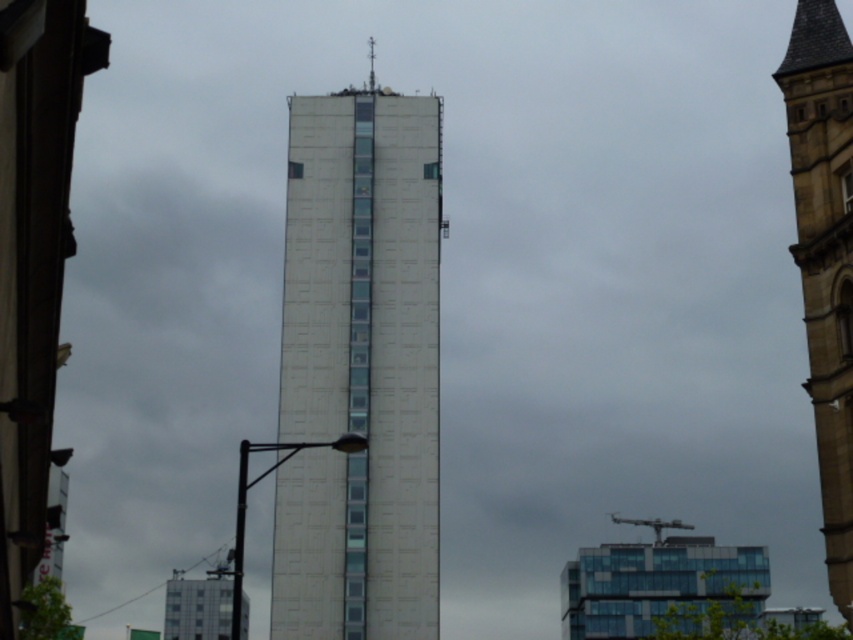
Identify the location of white textured building at center. The image size is (853, 640). (358, 369).

Can you confirm if white textured building at center is smaller than stone tower at center?

Actually, white textured building at center might be larger than stone tower at center.

Locate an element on the screen. white textured building at center is located at coordinates (358, 369).

Which is more to the left, white textured building at center or metallic spire at upper center?

metallic spire at upper center

Who is taller, white textured building at center or metallic spire at upper center?

white textured building at center is taller.

Identify the location of white textured building at center. This screenshot has height=640, width=853. (358, 369).

Identify the location of white textured building at center. (358, 369).

Is point (836, 276) positioned before point (372, 80)?

Yes.

Does stone tower at center appear over metallic spire at upper center?

Actually, stone tower at center is below metallic spire at upper center.

This screenshot has height=640, width=853. What are the coordinates of `stone tower at center` in the screenshot? It's located at (825, 257).

The width and height of the screenshot is (853, 640). Identify the location of stone tower at center. (825, 257).